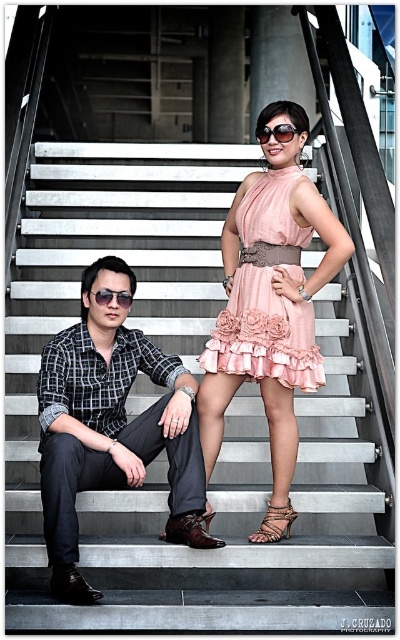
You are a photographer trying to capture a closeup shot of both the pink satin dress at center and the sunglasses at center. Given that your camera lens has a maximum focus range of 28 inches, will you be able to capture both objects in focus simultaneously?

The pink satin dress at center and sunglasses at center are 29.08 inches apart. Since the distance between them exceeds the camera lens maximum focus range of 28 inches, you will not be able to capture both objects in focus simultaneously.

You are a photographer trying to capture the perfect shot of the scene. The pink chiffon dress at center is crucial for the composition. Based on its 2D coordinates, where should you position your camera to ensure it is centered in the frame?

To center the pink chiffon dress at center in the frame, position your camera so that the dress aligns with the center point of the image, which corresponds to the coordinates provided at point (270, 300).

You are an observer looking at the scene. Which object is located more to the left between the checkered fabric shirt at left and the brown leather sandal at lower center?

The checkered fabric shirt at left is positioned more to the left than the brown leather sandal at lower center according to the description.